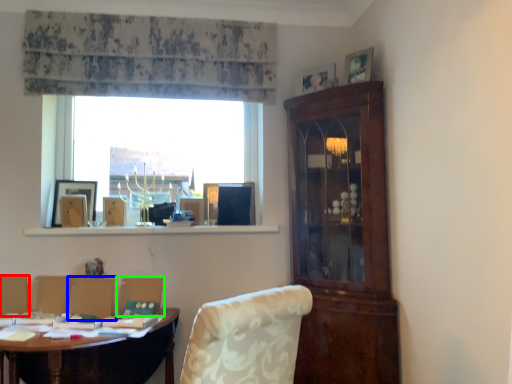
Question: Considering the real-world distances, which object is closest to armchair (highlighted by a red box)? armchair (highlighted by a blue box) or armchair (highlighted by a green box).

Choices:
 (A) armchair
 (B) armchair

Answer: (A)